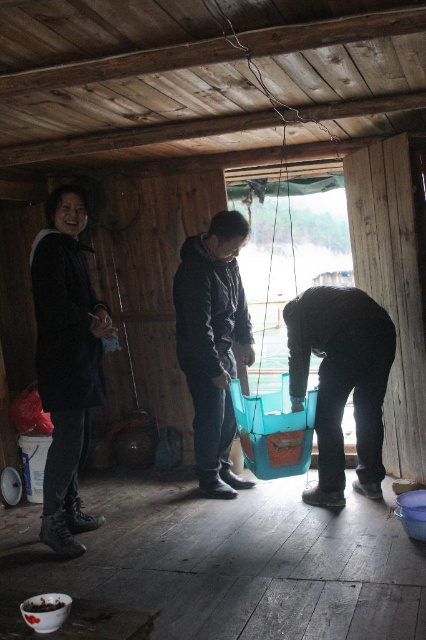
You are a delivery robot with a width of 1 meter. You need to move from the entrance to the brown matte bowl at lower left without hitting the matte black jacket at left. Is there enough space between them?

The distance between the matte black jacket at left and the brown matte bowl at lower left is 1.35 meters. Since the robot is 1 meter wide, there is sufficient space to navigate between them without collision.

You are a delivery person who needs to place a package on the floor near the blue plastic bucket at lower right. However, there is a matte black jacket at left in the way. Can you move the jacket to make space?

The matte black jacket at left is much taller than the blue plastic bucket at lower right, so it might block access to the area near the bucket. Moving the jacket would likely create enough space to place the package safely.

You are organizing items in the cabin and need to place the matte black jacket at left and the blue plastic bucket at lower right into storage. If the storage shelf has a width limit of 10 cm, which item can fit without exceeding the limit?

The matte black jacket at left is thinner than the blue plastic bucket at lower right, so the matte black jacket at left can fit into the storage shelf with a 10 cm width limit.